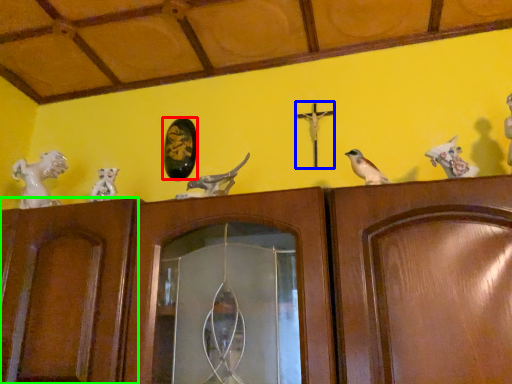
Question: Considering the real-world distances, which object is closest to art (highlighted by a red box)? crucifix (highlighted by a blue box) or door (highlighted by a green box).

Choices:
 (A) crucifix
 (B) door

Answer: (A)